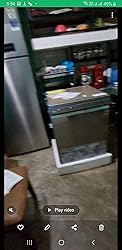
Image resolution: width=122 pixels, height=250 pixels. I want to click on fridge, so click(27, 128).